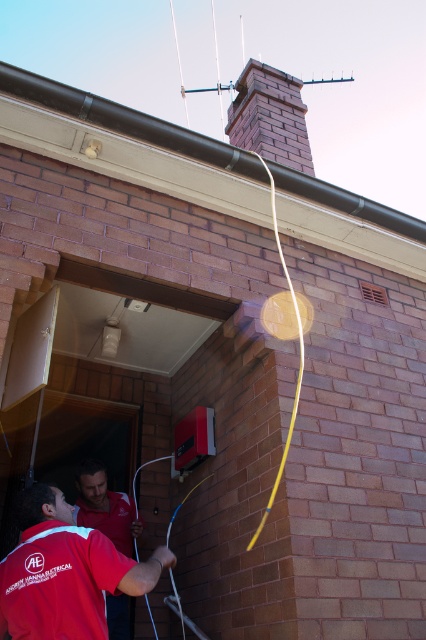
Question: Which of the following is the farthest from the observer?

Choices:
 (A) (258, 144)
 (B) (112, 513)
 (C) (9, 602)

Answer: (A)

Question: Considering the relative positions of red brick chimney at center and red matte shirt at lower left in the image provided, where is red brick chimney at center located with respect to red matte shirt at lower left?

Choices:
 (A) right
 (B) left

Answer: (A)

Question: Which of these objects is positioned closest to the red matte shirt at lower left?

Choices:
 (A) red fabric shirt at lower left
 (B) red brick chimney at center

Answer: (A)

Question: Which point is closer to the camera taking this photo?

Choices:
 (A) (249, 60)
 (B) (115, 557)
 (C) (94, 506)

Answer: (B)

Question: Does red fabric shirt at lower left lie behind red brick chimney at center?

Choices:
 (A) no
 (B) yes

Answer: (A)

Question: Is red fabric shirt at lower left bigger than red matte shirt at lower left?

Choices:
 (A) no
 (B) yes

Answer: (B)